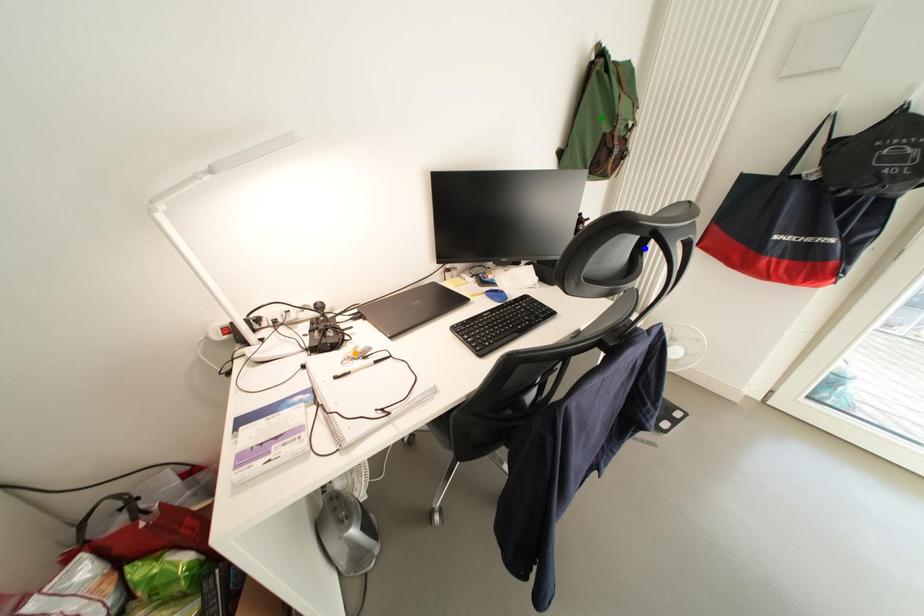
From the picture: Order these from farthest to nearest:
blue point, green point, orange point

green point → orange point → blue point